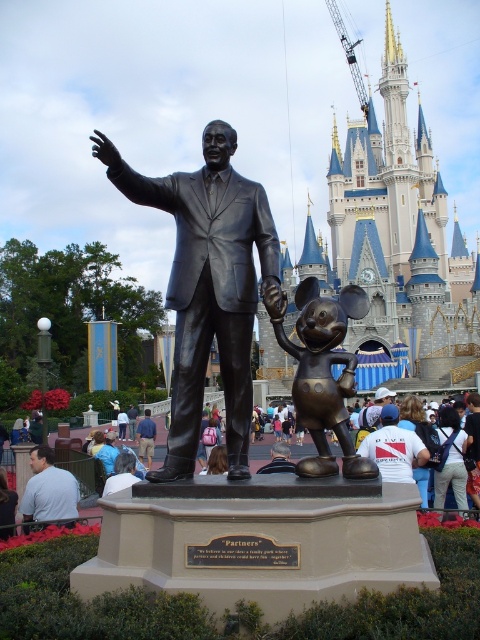
Based on the coordinates provided, where is the bronze mickey mouse at center located in the image?

The bronze mickey mouse at center is located at the coordinates point (322, 371) in the image.

You are standing in front of the statue of Walt Disney and Mickey Mouse at Disney World. You see two points marked in the image. The first point is at coordinate point (285, 296) and the second point is at coordinate point (147, 412). Which point is closer to you?

Point (285, 296) is closer to the viewer than point (147, 412).

You are standing at the base of the statue and want to take a photo of the point at coordinate point (308, 401). The camera you are using has a maximum focus range of 60 meters. Will the camera be able to focus on the point?

The distance of point (308, 401) from viewer is 60.86 meters, which exceeds the camera maximum focus range of 60 meters. Therefore, the camera will not be able to focus on the point.